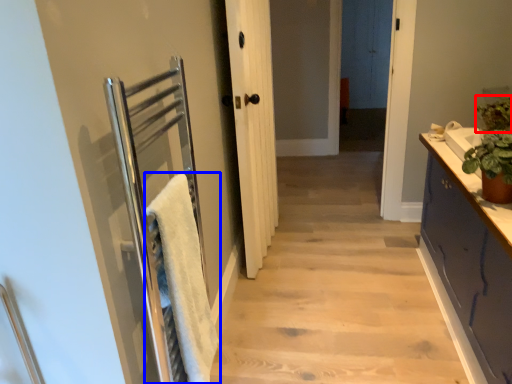
Question: Among these objects, which one is farthest to the camera, plant (highlighted by a red box) or bath towel (highlighted by a blue box)?

Choices:
 (A) plant
 (B) bath towel

Answer: (A)